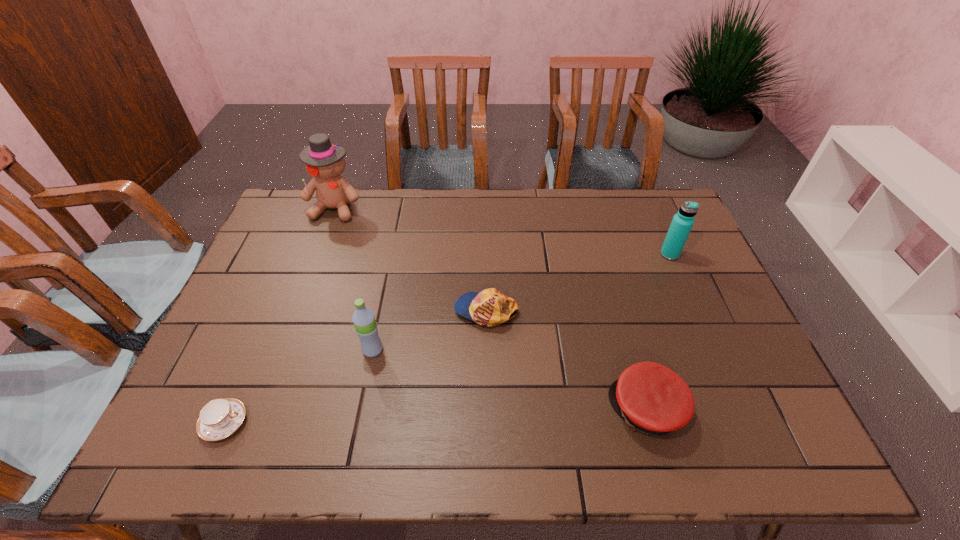
The height and width of the screenshot is (540, 960). I want to click on the shortest object, so pos(219,418).

In order to click on free space located 0.210m on the front-facing side of the rag_doll in this screenshot , I will do `click(313, 267)`.

Identify the location of free spot located on the back of the right water bottle. The height and width of the screenshot is (540, 960). (650, 210).

Locate an element on the screen. vacant space positioned on the left of the third nearest object is located at coordinates (281, 350).

Identify the location of free space located at the front of the right cap where the visor is located. The image size is (960, 540). (477, 410).

Identify the location of free space located 0.140m at the front of the right cap where the visor is located. (550, 410).

You are a GUI agent. You are given a task and a screenshot of the screen. Output one action in this format:
    pyautogui.click(x=<x>, y=<y>)
    Task: Click on the free spot located at the front of the right cap where the visor is located
    This screenshot has height=540, width=960.
    Given the screenshot: What is the action you would take?
    pyautogui.click(x=472, y=410)

This screenshot has height=540, width=960. I want to click on vacant area situated on the bill of the farther cap, so click(x=314, y=310).

I want to click on free spot located 0.230m on the bill of the farther cap, so click(372, 310).

You are a GUI agent. You are given a task and a screenshot of the screen. Output one action in this format:
    pyautogui.click(x=<x>, y=<y>)
    Task: Click on the free space located on the bill of the farther cap
    Image resolution: width=960 pixels, height=540 pixels.
    Given the screenshot: What is the action you would take?
    [365, 310]